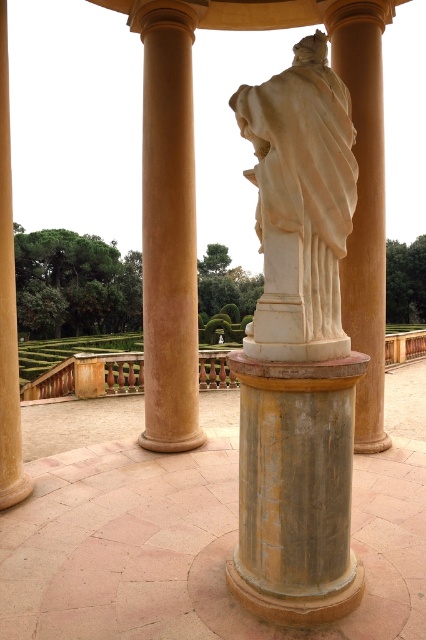
Question: Can you confirm if white marble statue at center is positioned above white marble column at center?

Choices:
 (A) no
 (B) yes

Answer: (A)

Question: Can you confirm if smooth beige column at center is bigger than white marble column at center?

Choices:
 (A) yes
 (B) no

Answer: (A)

Question: Which point appears farthest from the camera in this image?

Choices:
 (A) (166, 70)
 (B) (368, 424)
 (C) (13, 308)
 (D) (313, 328)

Answer: (A)

Question: Which point is farther to the camera?

Choices:
 (A) (362, 65)
 (B) (319, 188)
 (C) (337, 404)

Answer: (A)

Question: Which object appears closest to the camera in this image?

Choices:
 (A) white marble column at center
 (B) smooth beige column at left
 (C) white marble statue at center
 (D) gray stone column at center

Answer: (D)

Question: Can you confirm if white marble statue at center is positioned to the right of white marble column at center?

Choices:
 (A) no
 (B) yes

Answer: (A)